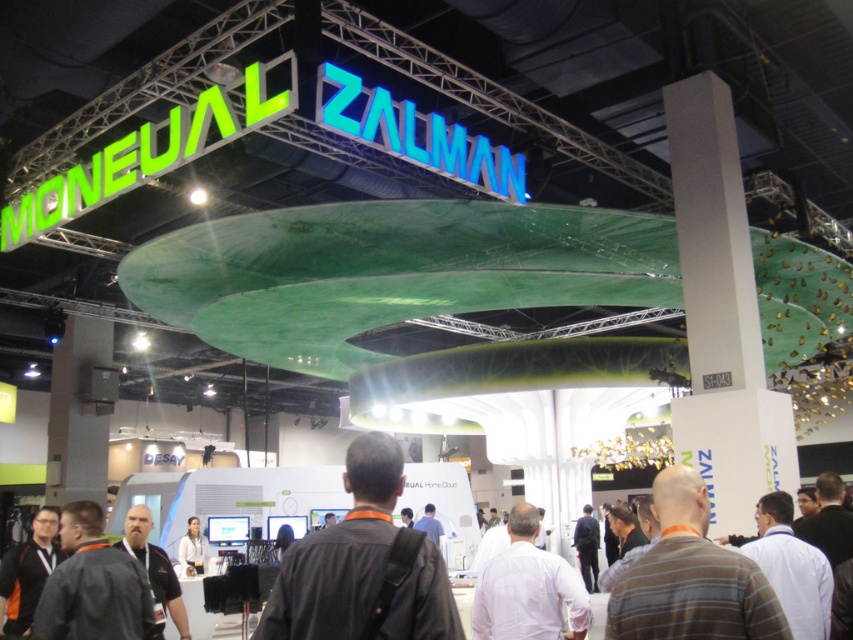
Question: Can you confirm if brown plaid shirt at lower right is positioned below black leather jacket at lower left?

Choices:
 (A) yes
 (B) no

Answer: (B)

Question: Which point is closer to the camera?

Choices:
 (A) white matte shirt at center
 (B) black leather jacket at lower left
 (C) brown plaid shirt at lower right

Answer: (C)

Question: Is dark gray fabric jacket at lower left positioned at the back of white matte jacket at lower center?

Choices:
 (A) no
 (B) yes

Answer: (A)

Question: Can you confirm if black fabric backpack at center is bigger than brown plaid shirt at lower right?

Choices:
 (A) no
 (B) yes

Answer: (A)

Question: Based on their relative distances, which object is farther from the black fabric backpack at center?

Choices:
 (A) white matte shirt at center
 (B) white matte jacket at lower center
 (C) black leather jacket at lower left

Answer: (B)

Question: Which is farther from the black leather jacket at lower left?

Choices:
 (A) brown plaid shirt at lower right
 (B) black fabric backpack at center
 (C) white matte jacket at lower center

Answer: (C)